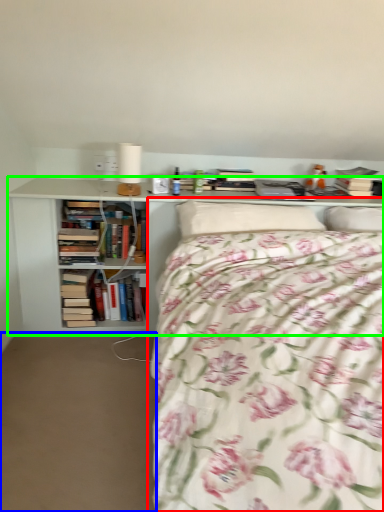
Question: Which is nearer to the bed (highlighted by a red box)? plain (highlighted by a blue box) or bookcase (highlighted by a green box).

Choices:
 (A) plain
 (B) bookcase

Answer: (B)